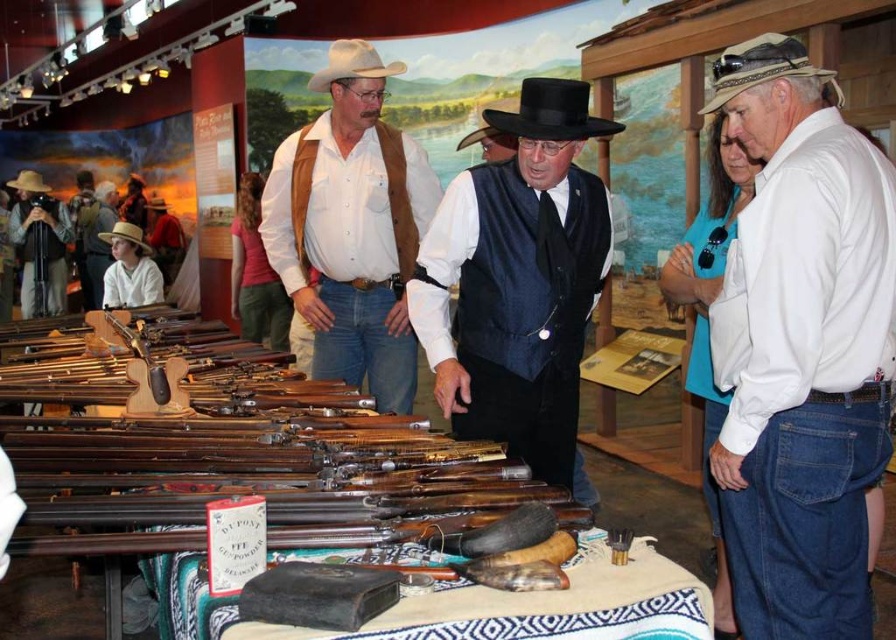
Is tan fabric cowboy hat at upper right closer to camera compared to brown felt cowboy hat at upper left?

Yes, tan fabric cowboy hat at upper right is closer to the viewer.

What do you see at coordinates (764, 68) in the screenshot? I see `tan fabric cowboy hat at upper right` at bounding box center [764, 68].

This screenshot has height=640, width=896. What are the coordinates of `tan fabric cowboy hat at upper right` in the screenshot? It's located at (764, 68).

Between black felt cowboy hat at center and brown felt cowboy hat at center, which one is positioned higher?

Positioned higher is brown felt cowboy hat at center.

How distant is black felt cowboy hat at center from brown felt cowboy hat at center?

They are 4.30 meters apart.

Is point (584, 116) positioned behind point (489, 134)?

No, it is in front of (489, 134).

Identify the location of black felt cowboy hat at center. The width and height of the screenshot is (896, 640). (550, 113).

Can you confirm if matte brown vest at center is smaller than light brown straw cowboy hat at lower left?

Actually, matte brown vest at center might be larger than light brown straw cowboy hat at lower left.

Is point (359, 248) closer to viewer compared to point (105, 230)?

Yes, it is in front of point (105, 230).

Is point (423, 220) less distant than point (139, 244)?

Yes, point (423, 220) is in front of point (139, 244).

This screenshot has width=896, height=640. I want to click on matte brown vest at center, so click(351, 227).